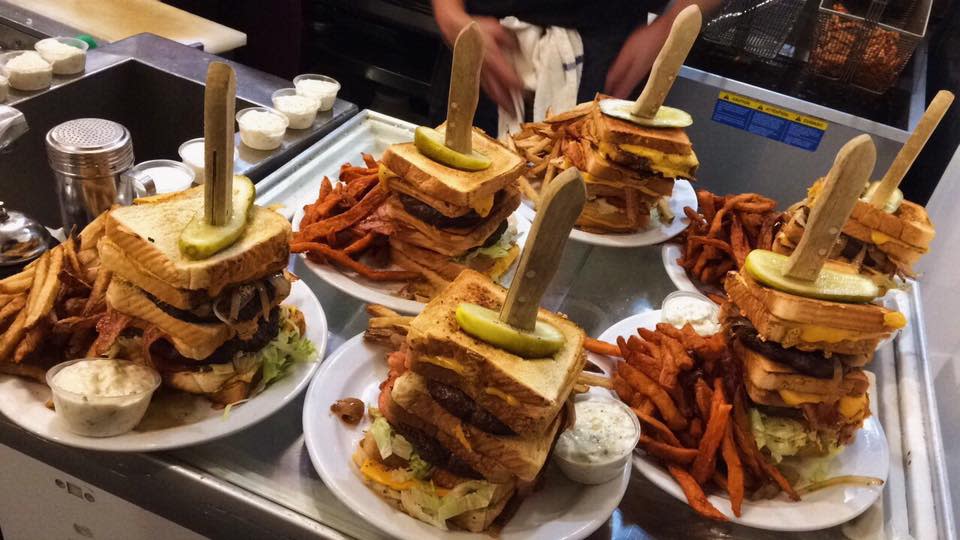
What are the coordinates of `basket` in the screenshot? It's located at (895, 40).